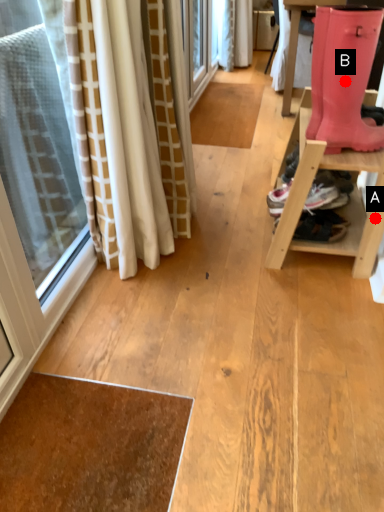
Question: Two points are circled on the image, labeled by A and B beside each circle. Which point is closer to the camera?

Choices:
 (A) A is closer
 (B) B is closer

Answer: (B)